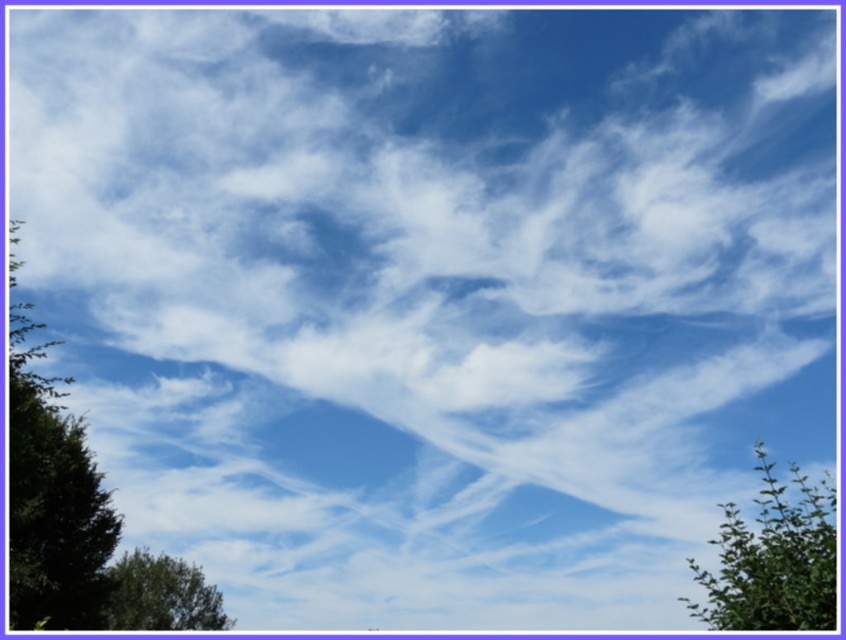
Question: Which object appears farthest from the camera in this image?

Choices:
 (A) green leafy tree at lower left
 (B) green leafy tree at left
 (C) green leafy tree at lower right

Answer: (A)

Question: Is green leafy tree at left closer to camera compared to green leafy tree at lower left?

Choices:
 (A) no
 (B) yes

Answer: (B)

Question: Is the position of green leafy tree at left less distant than that of green leafy tree at lower right?

Choices:
 (A) no
 (B) yes

Answer: (A)

Question: Which point is closer to the camera taking this photo?

Choices:
 (A) (786, 616)
 (B) (36, 397)

Answer: (A)

Question: Is green leafy tree at left smaller than green leafy tree at lower left?

Choices:
 (A) yes
 (B) no

Answer: (B)

Question: Which object is positioned closest to the green leafy tree at lower left?

Choices:
 (A) green leafy tree at lower right
 (B) green leafy tree at left

Answer: (B)